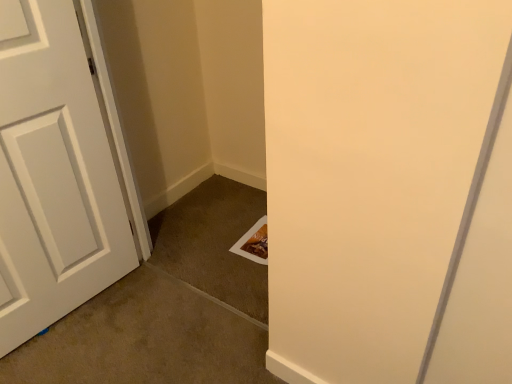
Where is `white matte door at left`? white matte door at left is located at coordinates (53, 175).

The width and height of the screenshot is (512, 384). What do you see at coordinates (53, 175) in the screenshot? I see `white matte door at left` at bounding box center [53, 175].

Locate an element on the screen. Image resolution: width=512 pixels, height=384 pixels. white matte door at left is located at coordinates (53, 175).